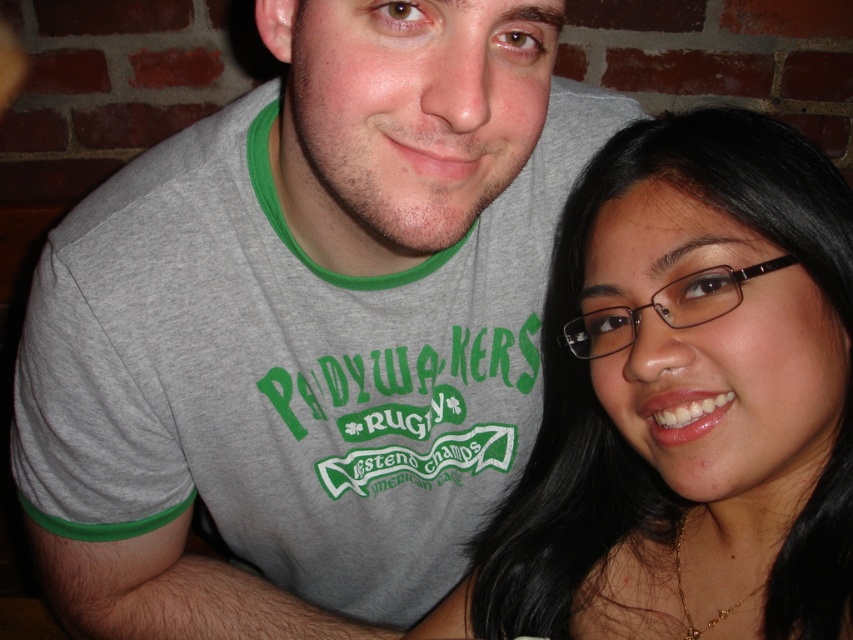
Who is lower down, gray cotton t-shirt at upper left or smooth skin face at center?

smooth skin face at center is below.

What do you see at coordinates (305, 326) in the screenshot? I see `gray cotton t-shirt at upper left` at bounding box center [305, 326].

Between point (512, 24) and point (809, 620), which one is positioned behind?

The point (809, 620) is more distant.

Find the location of a particular element. The width and height of the screenshot is (853, 640). gray cotton t-shirt at upper left is located at coordinates (305, 326).